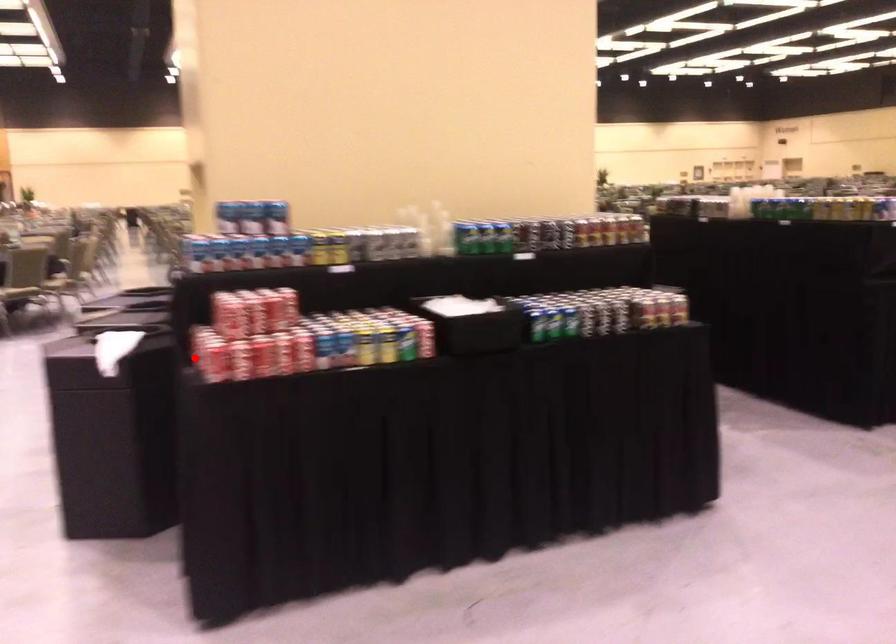
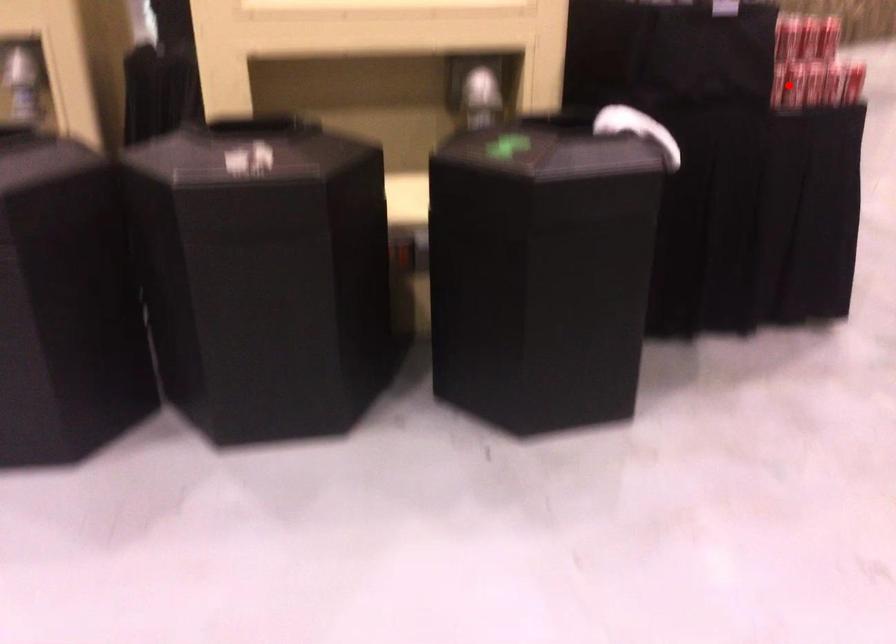
I am providing you with two images of the same scene from different viewpoints. A red point is marked on the first image and another point is marked on the second image. Do the highlighted points in image1 and image2 indicate the same real-world spot?

No